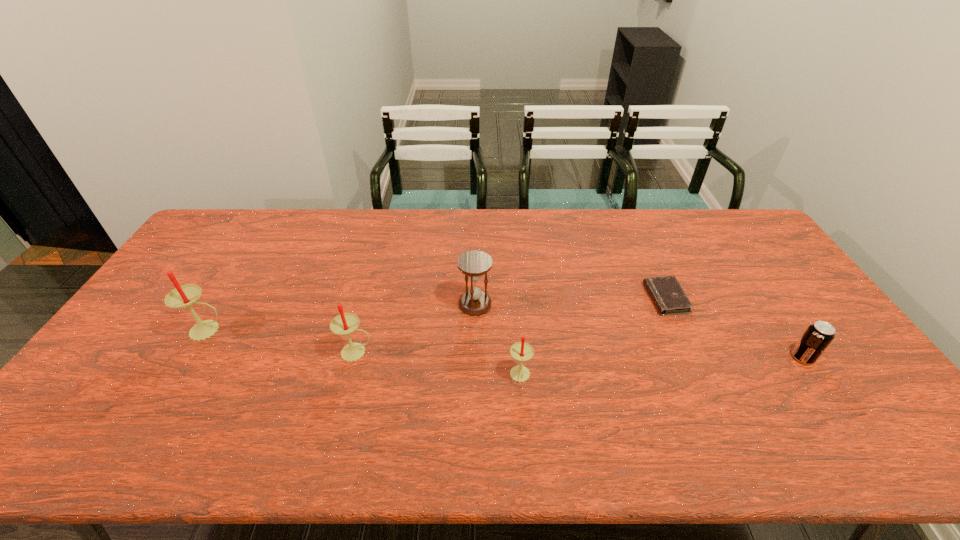
This screenshot has width=960, height=540. In order to click on diary in this screenshot , I will do `click(667, 294)`.

Where is `vacant area situated 0.310m on the back of the leftmost object`? The width and height of the screenshot is (960, 540). vacant area situated 0.310m on the back of the leftmost object is located at coordinates (255, 252).

Find the location of a particular element. The width and height of the screenshot is (960, 540). free region located 0.080m on the left of the second candle from right to left is located at coordinates (310, 352).

Identify the location of free space located 0.280m on the left of the fourth object from left to right. (400, 376).

Find the location of a particular element. blank space located 0.370m on the back of the third object from left to right is located at coordinates point(476,224).

Where is `vacant area situated on the left of the soda can`? This screenshot has width=960, height=540. vacant area situated on the left of the soda can is located at coordinates (709, 357).

Identify the location of free point located on the left of the shortest object. [621, 299].

Find the location of `object that is at the near edge`. object that is at the near edge is located at coordinates (521, 351).

The image size is (960, 540). Identify the location of object located at the right edge. point(817,337).

In the image, there is a desktop. At what (x,y) coordinates should I click in order to perform the action: click on vacant space at the far edge. Please return your answer as a coordinate pair (x, y). The width and height of the screenshot is (960, 540). Looking at the image, I should click on (269, 229).